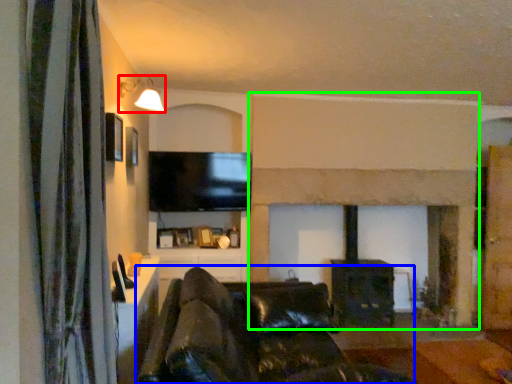
Question: Considering the real-world distances, which object is farthest from light fixture (highlighted by a red box)? studio couch (highlighted by a blue box) or fireplace (highlighted by a green box)?

Choices:
 (A) studio couch
 (B) fireplace

Answer: (B)